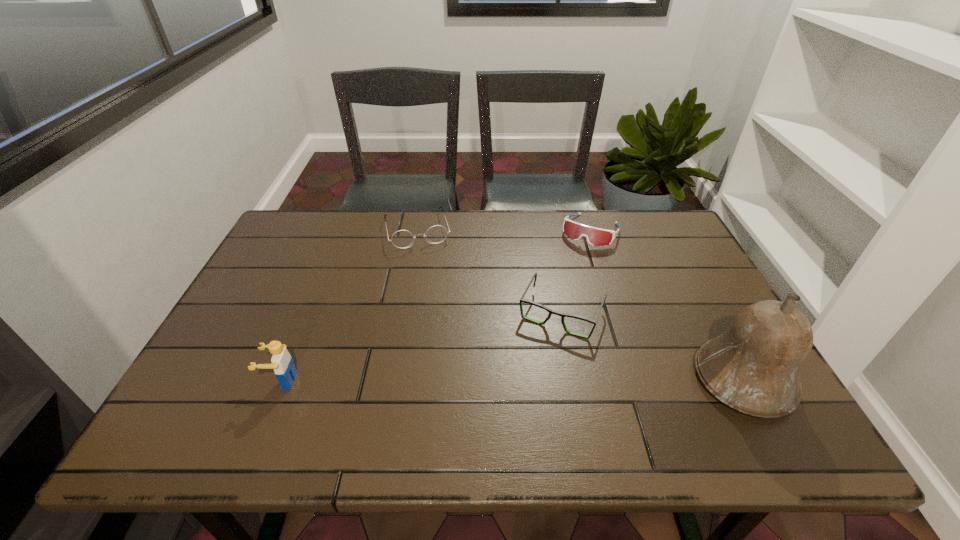
Identify the location of vacant spot on the desktop that is between the Lego and the rightmost object and is positioned on the lens of the nearer spectacles. (532, 380).

Locate an element on the screen. vacant space on the desktop that is between the fourth shortest object and the tallest object and is positioned on the front-facing side of the goggles is located at coordinates (507, 380).

In order to click on free space on the desktop that is between the fourth shortest object and the rightmost object and is positioned on the front-facing side of the farther spectacles in this screenshot , I will do `click(454, 380)`.